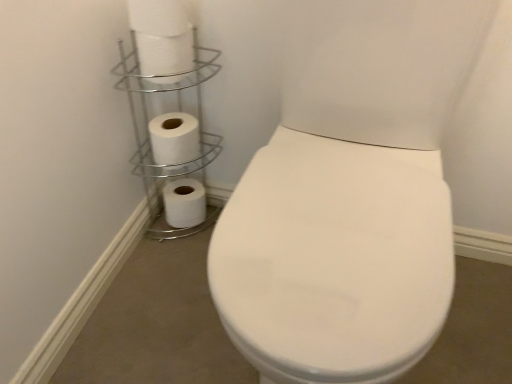
Question: Is white matte toilet paper at upper left, placed as the second toilet paper when sorted from top to bottom, completely or partially inside white matte toilet paper at upper left, the fourth toilet paper in the bottom-to-top sequence?

Choices:
 (A) yes
 (B) no

Answer: (B)

Question: Is white matte toilet paper at upper left, the fourth toilet paper in the bottom-to-top sequence, oriented away from white matte toilet paper at upper left, the 2th toilet paper from the front?

Choices:
 (A) yes
 (B) no

Answer: (B)

Question: Is the depth of white matte toilet paper at upper left, the fourth toilet paper in the bottom-to-top sequence, less than that of white matte toilet paper at upper left, marked as the 3th toilet paper in a bottom-to-top arrangement?

Choices:
 (A) yes
 (B) no

Answer: (A)

Question: Considering the relative sizes of white matte toilet paper at upper left, which is counted as the 4th toilet paper, starting from the back, and white matte toilet paper at upper left, placed as the second toilet paper when sorted from top to bottom, in the image provided, is white matte toilet paper at upper left, which is counted as the 4th toilet paper, starting from the back, wider than white matte toilet paper at upper left, placed as the second toilet paper when sorted from top to bottom,?

Choices:
 (A) yes
 (B) no

Answer: (A)

Question: From the image's perspective, is white matte toilet paper at upper left, positioned as the 1th toilet paper in top-to-bottom order, beneath white matte toilet paper at upper left, marked as the 3th toilet paper in a bottom-to-top arrangement?

Choices:
 (A) yes
 (B) no

Answer: (B)

Question: Relative to white matte toilet paper at lower left, which ranks as the fourth toilet paper in front-to-back order, is white matte toilet paper at upper left, the 2th toilet paper from the front, in front or behind?

Choices:
 (A) behind
 (B) front

Answer: (B)

Question: Looking at the image, does white matte toilet paper at upper left, which is counted as the third toilet paper, starting from the back, seem bigger or smaller compared to white matte toilet paper at lower left, which is the fourth toilet paper in top-to-bottom order?

Choices:
 (A) big
 (B) small

Answer: (B)

Question: From their relative heights in the image, would you say white matte toilet paper at upper left, which is counted as the third toilet paper, starting from the back, is taller or shorter than white matte toilet paper at lower left, which ranks as the fourth toilet paper in front-to-back order?

Choices:
 (A) tall
 (B) short

Answer: (B)

Question: From the image's perspective, is white matte toilet paper at upper left, marked as the 3th toilet paper in a bottom-to-top arrangement, located above or below white matte toilet paper at lower left, which is the 1th toilet paper in bottom-to-top order?

Choices:
 (A) above
 (B) below

Answer: (A)

Question: In the image, is white matte toilet paper at upper left, the 2th toilet paper in the back-to-front sequence, positioned in front of or behind silver/metallic toilet paper holder at upper left?

Choices:
 (A) front
 (B) behind

Answer: (B)

Question: From a real-world perspective, is white matte toilet paper at upper left, the 2th toilet paper in the back-to-front sequence, above or below silver/metallic toilet paper holder at upper left?

Choices:
 (A) below
 (B) above

Answer: (B)

Question: Is white matte toilet paper at upper left, placed as the third toilet paper when sorted from front to back, situated inside silver/metallic toilet paper holder at upper left or outside?

Choices:
 (A) inside
 (B) outside

Answer: (A)

Question: Considering the positions of white matte toilet paper at upper left, the 2th toilet paper from the bottom, and silver/metallic toilet paper holder at upper left in the image, is white matte toilet paper at upper left, the 2th toilet paper from the bottom, taller or shorter than silver/metallic toilet paper holder at upper left?

Choices:
 (A) tall
 (B) short

Answer: (B)

Question: From a real-world perspective, is white matte toilet paper at upper left, marked as the 3th toilet paper in a bottom-to-top arrangement, above or below silver/metallic toilet paper holder at upper left?

Choices:
 (A) below
 (B) above

Answer: (B)

Question: From the image's perspective, is white matte toilet paper at upper left, placed as the second toilet paper when sorted from top to bottom, above or below silver/metallic toilet paper holder at upper left?

Choices:
 (A) above
 (B) below

Answer: (A)